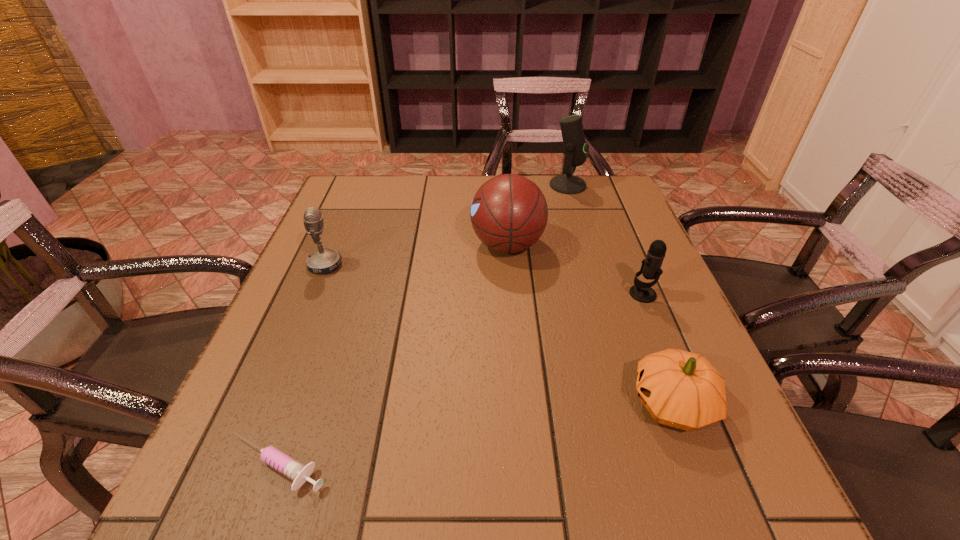
Where is `free spot between the fifth tallest object and the fourth farthest object`? free spot between the fifth tallest object and the fourth farthest object is located at coordinates (658, 349).

The width and height of the screenshot is (960, 540). In order to click on free space between the leftmost microphone and the basketball in this screenshot , I will do `click(417, 255)`.

Image resolution: width=960 pixels, height=540 pixels. What are the coordinates of `free spot between the farthest object and the leftmost microphone` in the screenshot? It's located at (446, 225).

Where is `unoccupied area between the farthest object and the shortest object`? This screenshot has width=960, height=540. unoccupied area between the farthest object and the shortest object is located at coordinates (422, 325).

The image size is (960, 540). In order to click on free space between the gourd and the farthest object in this screenshot , I will do `click(620, 294)`.

Locate an element on the screen. Image resolution: width=960 pixels, height=540 pixels. free space that is in between the shortest object and the fourth farthest object is located at coordinates (460, 380).

This screenshot has height=540, width=960. In order to click on blank region between the syringe and the leftmost microphone in this screenshot , I will do `click(301, 365)`.

This screenshot has height=540, width=960. Identify the location of empty space between the second farthest microphone and the farthest object. (446, 225).

Locate an element on the screen. The image size is (960, 540). vacant region between the second shortest object and the fourth object from right to left is located at coordinates (590, 324).

Find the location of `the fourth closest object to the farthest microphone`. the fourth closest object to the farthest microphone is located at coordinates 681,389.